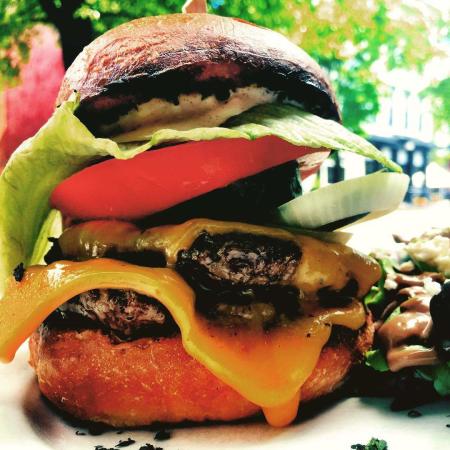
Where is `table top`? Image resolution: width=450 pixels, height=450 pixels. table top is located at coordinates (266, 436).